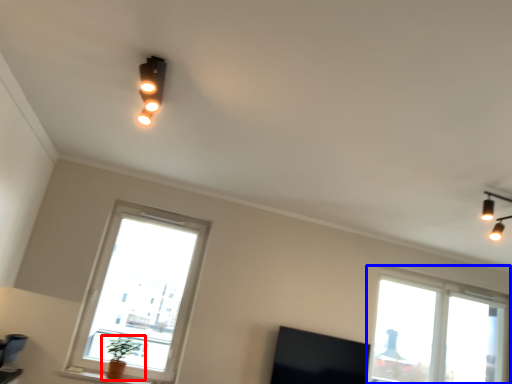
Question: Which of the following is the farthest to the observer, houseplant (highlighted by a red box) or window (highlighted by a blue box)?

Choices:
 (A) houseplant
 (B) window

Answer: (B)